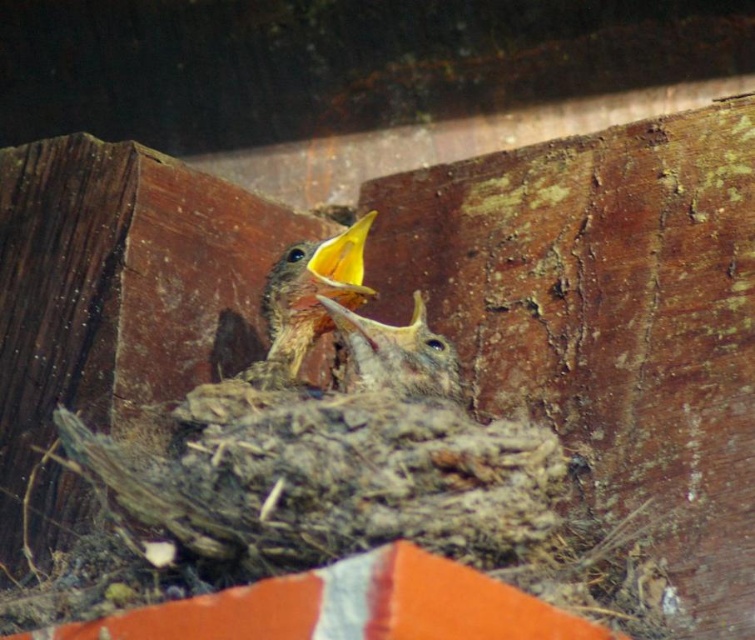
You are a parent bird returning to the nest. You see the brown speckled feathers at center and the yellow matte beak at center. Which one is higher up in the nest?

The brown speckled feathers at center is taller than the yellow matte beak at center, so the brown speckled feathers at center is higher up in the nest.

You are a parent bird returning to the nest. You see the smooth brown bird at center and the yellow matte beak at center. Which one is positioned lower in the nest?

The smooth brown bird at center is located below the yellow matte beak at center, so the smooth brown bird at center is positioned lower in the nest.